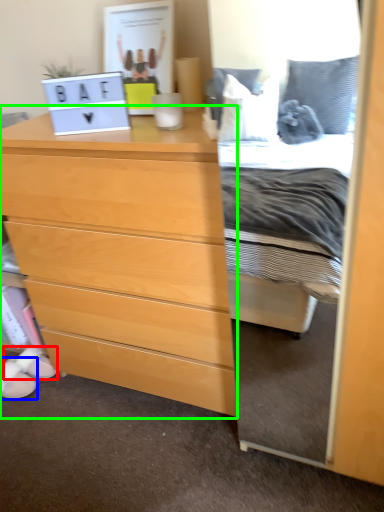
Question: Considering the real-world distances, which object is closest to shoe (highlighted by a red box)? shoe (highlighted by a blue box) or chest of drawers (highlighted by a green box).

Choices:
 (A) shoe
 (B) chest of drawers

Answer: (A)